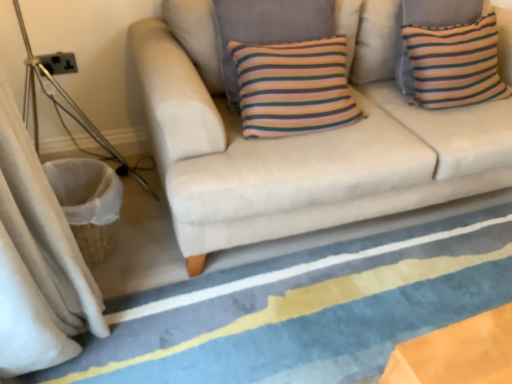
The image size is (512, 384). Find the location of `beige fabric curtain at left`. beige fabric curtain at left is located at coordinates (37, 261).

What is the approximate height of beige fabric curtain at left?

beige fabric curtain at left is 38.71 inches in height.

Image resolution: width=512 pixels, height=384 pixels. What are the coordinates of `beige fabric couch at center` in the screenshot? It's located at (303, 140).

At what (x,y) coordinates should I click in order to perform the action: click on striped fabric pillow at upper right. Please return your answer as a coordinate pair (x, y). This screenshot has height=384, width=512. Looking at the image, I should click on (455, 64).

Locate an element on the screen. This screenshot has width=512, height=384. pillow lying behind the beige fabric couch at center is located at coordinates (455, 64).

Considering the sizes of objects striped fabric pillow at upper right and beige fabric couch at center in the image provided, who is smaller, striped fabric pillow at upper right or beige fabric couch at center?

Smaller between the two is striped fabric pillow at upper right.

Which is closer to the camera, (452, 96) or (217, 67)?

Point (217, 67)

Can beige fabric couch at center be found inside striped fabric pillow at upper right?

Definitely not — beige fabric couch at center is not inside striped fabric pillow at upper right.

Is beige fabric curtain at left next to blue striped rug at lower center?

No, beige fabric curtain at left is not with blue striped rug at lower center.

How distant is beige fabric curtain at left from blue striped rug at lower center?

20.26 inches.

Considering their positions, is beige fabric curtain at left located in front of or behind blue striped rug at lower center?

Clearly, beige fabric curtain at left is in front of blue striped rug at lower center.

In the scene shown: Considering the sizes of objects beige fabric curtain at left and blue striped rug at lower center in the image provided, who is wider, beige fabric curtain at left or blue striped rug at lower center?

With larger width is blue striped rug at lower center.

Does blue striped rug at lower center have a lesser height compared to beige fabric couch at center?

Correct, blue striped rug at lower center is not as tall as beige fabric couch at center.

Does blue striped rug at lower center appear on the right side of beige fabric couch at center?

Incorrect, blue striped rug at lower center is not on the right side of beige fabric couch at center.

Can you confirm if blue striped rug at lower center is wider than beige fabric couch at center?

Correct, the width of blue striped rug at lower center exceeds that of beige fabric couch at center.

Which point is more forward, [349,342] or [190,18]?

Point [349,342]

Considering the sizes of objects beige fabric curtain at left and beige fabric couch at center in the image provided, who is bigger, beige fabric curtain at left or beige fabric couch at center?

With larger size is beige fabric couch at center.

Is beige fabric curtain at left positioned with its back to beige fabric couch at center?

beige fabric curtain at left is not turned away from beige fabric couch at center.

Which object is more forward, beige fabric curtain at left or beige fabric couch at center?

beige fabric curtain at left.

Does beige fabric curtain at left have a greater width compared to beige fabric couch at center?

In fact, beige fabric curtain at left might be narrower than beige fabric couch at center.

Looking at this image, how many degrees apart are the facing directions of blue striped rug at lower center and beige fabric curtain at left?

1.02 degrees.

Who is smaller, blue striped rug at lower center or beige fabric curtain at left?

blue striped rug at lower center is smaller.

In the scene shown: From the image's perspective, is blue striped rug at lower center below beige fabric curtain at left?

Yes, from the image's perspective, blue striped rug at lower center is beneath beige fabric curtain at left.

Could you tell me if blue striped rug at lower center is turned towards beige fabric curtain at left?

No, blue striped rug at lower center is not turned towards beige fabric curtain at left.

Considering the sizes of striped fabric pillow at upper right and blue striped rug at lower center in the image, is striped fabric pillow at upper right taller or shorter than blue striped rug at lower center?

In the image, striped fabric pillow at upper right appears to be taller than blue striped rug at lower center.

How different are the orientations of striped fabric pillow at upper right and blue striped rug at lower center in degrees?

The angular difference between striped fabric pillow at upper right and blue striped rug at lower center is 90 degrees.

Is striped fabric pillow at upper right to the right of blue striped rug at lower center from the viewer's perspective?

Yes, striped fabric pillow at upper right is to the right of blue striped rug at lower center.

Is striped fabric pillow at upper right positioned far away from blue striped rug at lower center?

striped fabric pillow at upper right is near blue striped rug at lower center, not far away.

Is point (351, 185) closer or farther from the camera than point (85, 298)?

Point (351, 185).

From a real-world perspective, which object rests below the other?

From a 3D spatial view, beige fabric couch at center is below.

Find the location of a particular element. This screenshot has width=512, height=384. curtain located above the beige fabric couch at center (from a real-world perspective) is located at coordinates (37, 261).

Relative to beige fabric curtain at left, is beige fabric couch at center in front or behind?

Visually, beige fabric couch at center is located behind beige fabric curtain at left.

This screenshot has height=384, width=512. I want to click on pillow above the beige fabric couch at center (from the image's perspective), so click(x=455, y=64).

Where is `curtain above the blue striped rug at lower center (from a real-world perspective)`? curtain above the blue striped rug at lower center (from a real-world perspective) is located at coordinates (37, 261).

Considering their positions, is striped fabric pillow at upper right positioned further to beige fabric couch at center than blue striped rug at lower center?

blue striped rug at lower center is positioned further to the anchor beige fabric couch at center.

Looking at the image, which one is located further to blue striped rug at lower center, beige fabric curtain at left or beige fabric couch at center?

Based on the image, beige fabric curtain at left appears to be further to blue striped rug at lower center.

Based on their spatial positions, is blue striped rug at lower center or beige fabric couch at center closer to striped fabric pillow at upper right?

The object closer to striped fabric pillow at upper right is beige fabric couch at center.

Looking at the image, which one is located closer to striped fabric pillow at upper right, beige fabric couch at center or blue striped rug at lower center?

beige fabric couch at center lies closer to striped fabric pillow at upper right than the other object.

Looking at the image, which one is located further to beige fabric couch at center, blue striped rug at lower center or beige fabric curtain at left?

Among the two, beige fabric curtain at left is located further to beige fabric couch at center.

Estimate the real-world distances between objects in this image. Which object is closer to striped fabric pillow at upper right, blue striped rug at lower center or beige fabric curtain at left?

blue striped rug at lower center is positioned closer to the anchor striped fabric pillow at upper right.

In the scene shown: From the image, which object appears to be farther from beige fabric couch at center, striped fabric pillow at upper right or beige fabric curtain at left?

Based on the image, beige fabric curtain at left appears to be further to beige fabric couch at center.

From the image, which object appears to be nearer to blue striped rug at lower center, beige fabric couch at center or striped fabric pillow at upper right?

Among the two, beige fabric couch at center is located nearer to blue striped rug at lower center.

Locate an element on the screen. The image size is (512, 384). strip between beige fabric curtain at left and beige fabric couch at center in the horizontal direction is located at coordinates (304, 309).

The height and width of the screenshot is (384, 512). Identify the location of studio couch between beige fabric curtain at left and striped fabric pillow at upper right in the horizontal direction. tap(303, 140).

This screenshot has height=384, width=512. In order to click on studio couch between striped fabric pillow at upper right and blue striped rug at lower center in the up-down direction in this screenshot , I will do `click(303, 140)`.

This screenshot has width=512, height=384. I want to click on strip situated between beige fabric curtain at left and striped fabric pillow at upper right from left to right, so click(x=304, y=309).